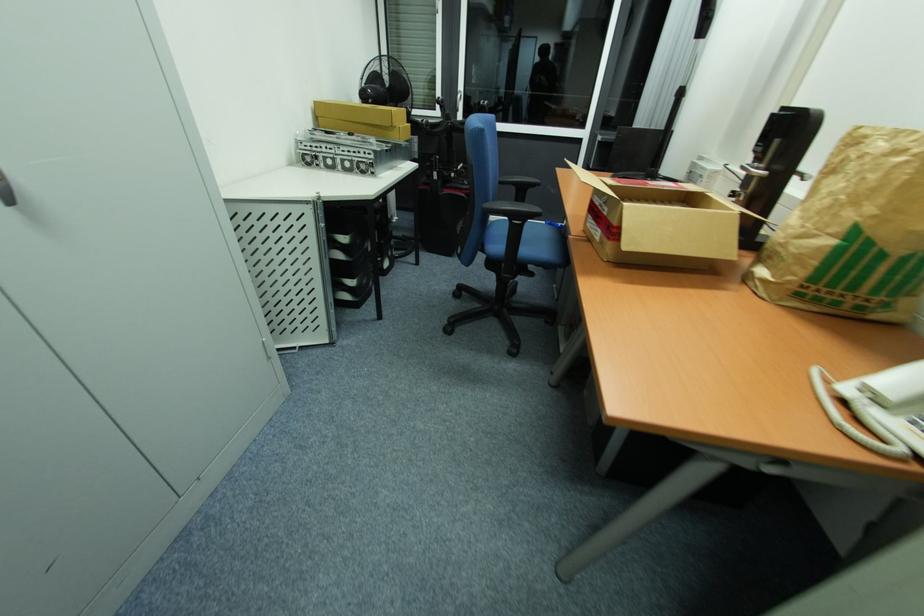
Which object does [660,223] point to?

It corresponds to the open cardboard box in the image.